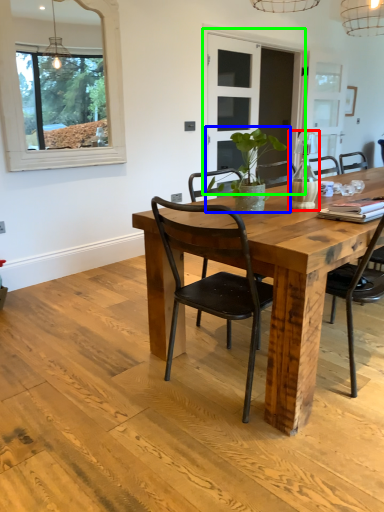
Question: Which object is the farthest from vase (highlighted by a red box)? Choose among these: houseplant (highlighted by a blue box) or glass door (highlighted by a green box).

Choices:
 (A) houseplant
 (B) glass door

Answer: (B)